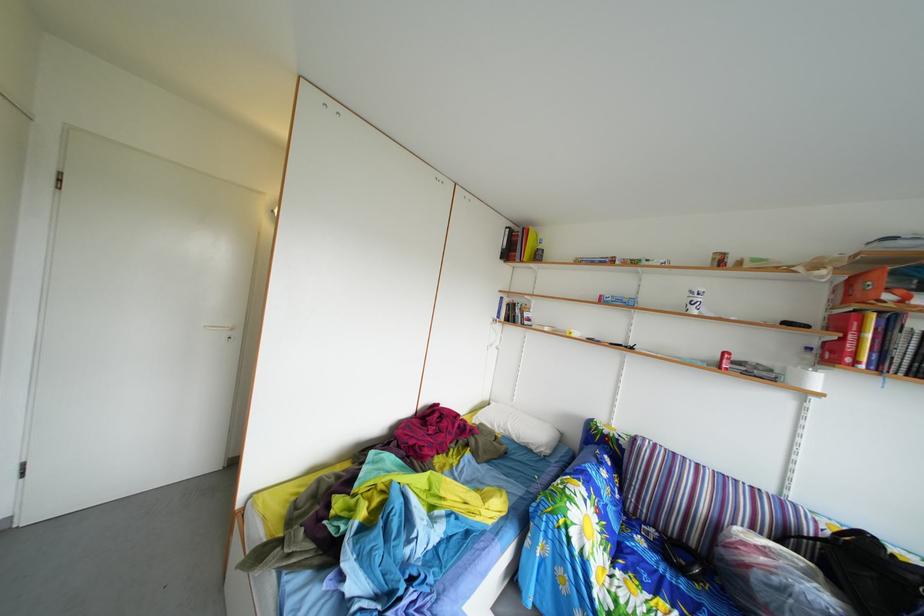
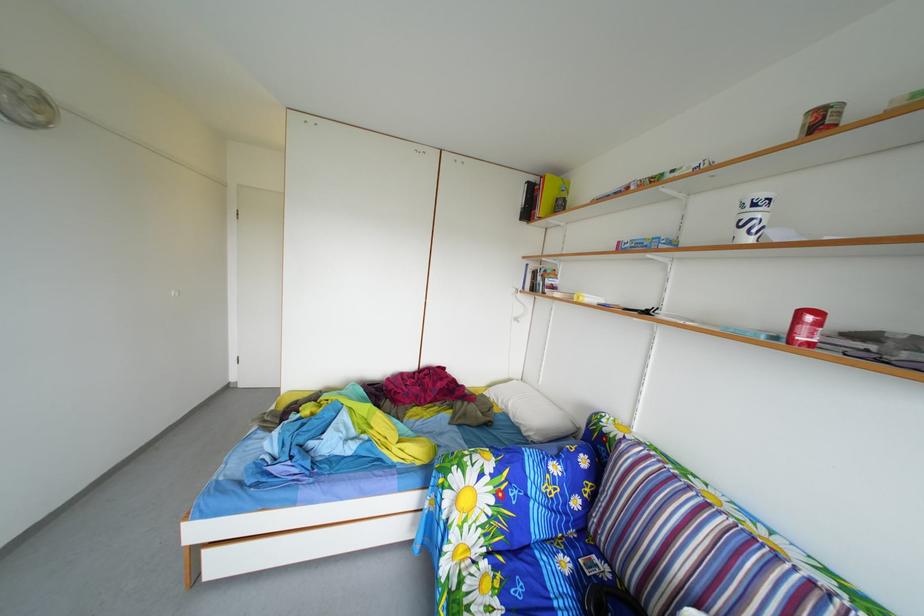
Where in the second image is the point corresponding to [735,362] from the first image?

(811, 321)